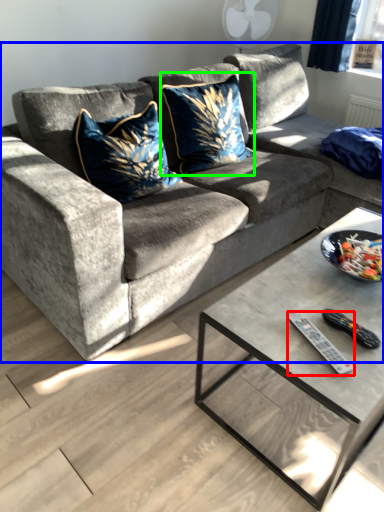
Question: Estimate the real-world distances between objects in this image. Which object is farther from remote (highlighted by a red box), studio couch (highlighted by a blue box) or throw pillow (highlighted by a green box)?

Choices:
 (A) studio couch
 (B) throw pillow

Answer: (B)